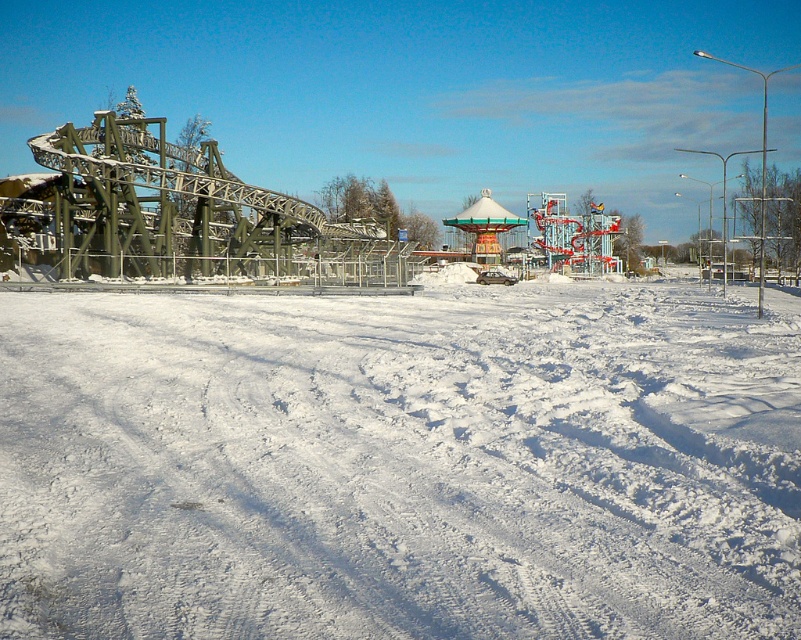
Is point (687, 586) closer to camera compared to point (127, 234)?

That is True.

Who is lower down, white snow at lower center or metal roller coaster at left?

white snow at lower center is below.

Which is behind, point (687, 524) or point (353, 216)?

The point (353, 216) is more distant.

This screenshot has width=801, height=640. What are the coordinates of `white snow at lower center` in the screenshot? It's located at (399, 465).